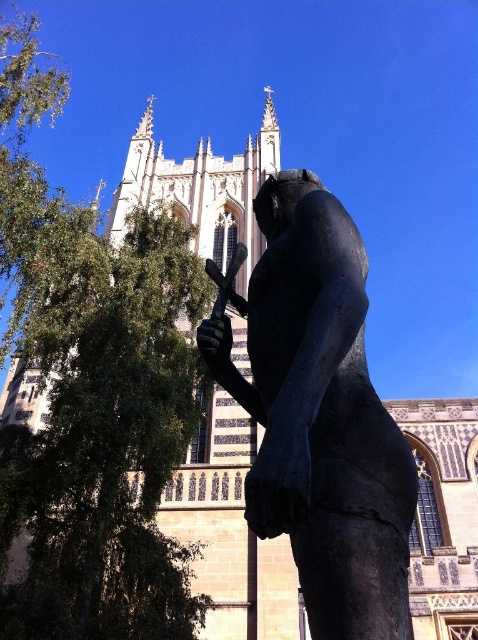
Question: Which object is farther from the camera taking this photo?

Choices:
 (A) green leafy tree at left
 (B) bronze statue at center

Answer: (A)

Question: Can you confirm if green leafy tree at left is smaller than bronze statue at center?

Choices:
 (A) no
 (B) yes

Answer: (A)

Question: Is green leafy tree at left positioned before bronze statue at center?

Choices:
 (A) no
 (B) yes

Answer: (A)

Question: Which point is closer to the camera?

Choices:
 (A) bronze statue at center
 (B) green leafy tree at left

Answer: (A)

Question: Does green leafy tree at left have a larger size compared to bronze statue at center?

Choices:
 (A) no
 (B) yes

Answer: (B)